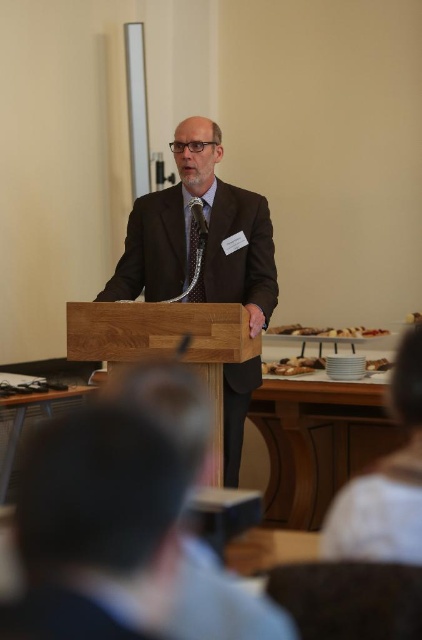
Question: Which point is farther to the camera?

Choices:
 (A) (370, 360)
 (B) (91, 301)

Answer: (A)

Question: Which point is farther from the camera taking this photo?

Choices:
 (A) (413, 380)
 (B) (240, 305)
 (C) (370, 369)

Answer: (C)

Question: Can you confirm if wooden podium at center is positioned to the left of black textured tie at center?

Choices:
 (A) yes
 (B) no

Answer: (A)

Question: Can you confirm if matte brown suit at center is wider than wooden podium at center?

Choices:
 (A) no
 (B) yes

Answer: (A)

Question: Which object is the farthest from the matte brown suit at center?

Choices:
 (A) brown crumbly pastry at center
 (B) black textured tie at center
 (C) white fabric at lower right

Answer: (C)

Question: Can you confirm if white fabric at lower right is positioned below white glossy plate at lower center?

Choices:
 (A) yes
 (B) no

Answer: (A)